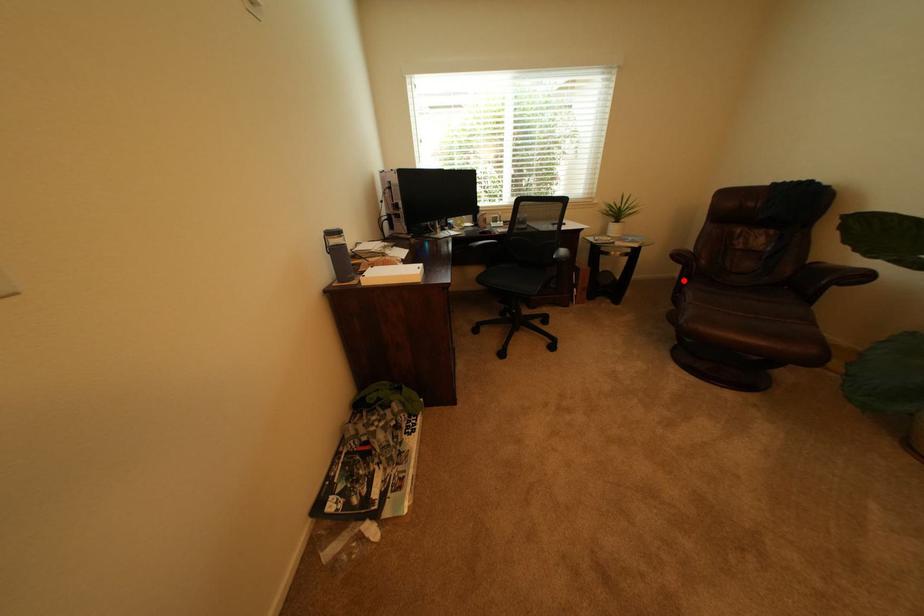
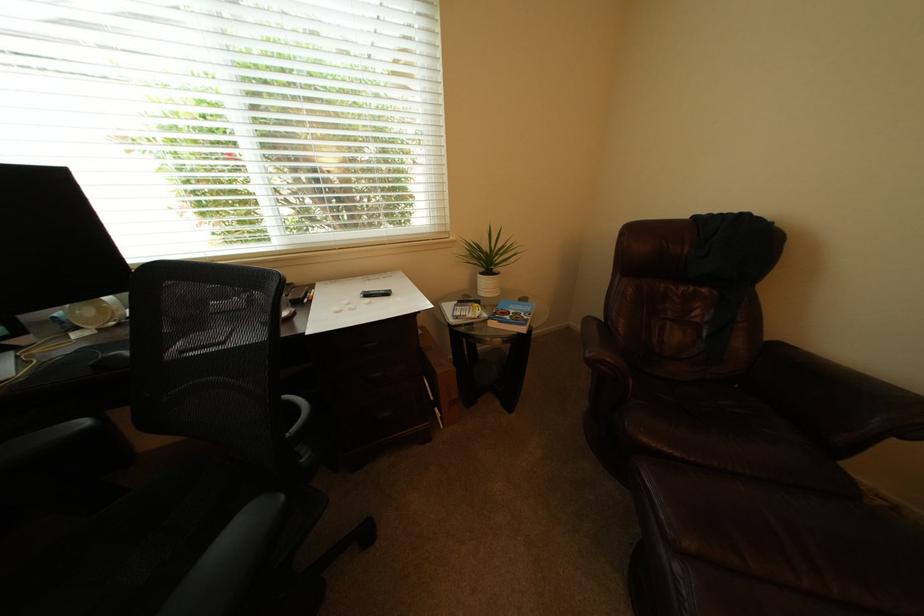
In the second image, find the point that corresponds to the highlighted location in the first image.

(579, 331)